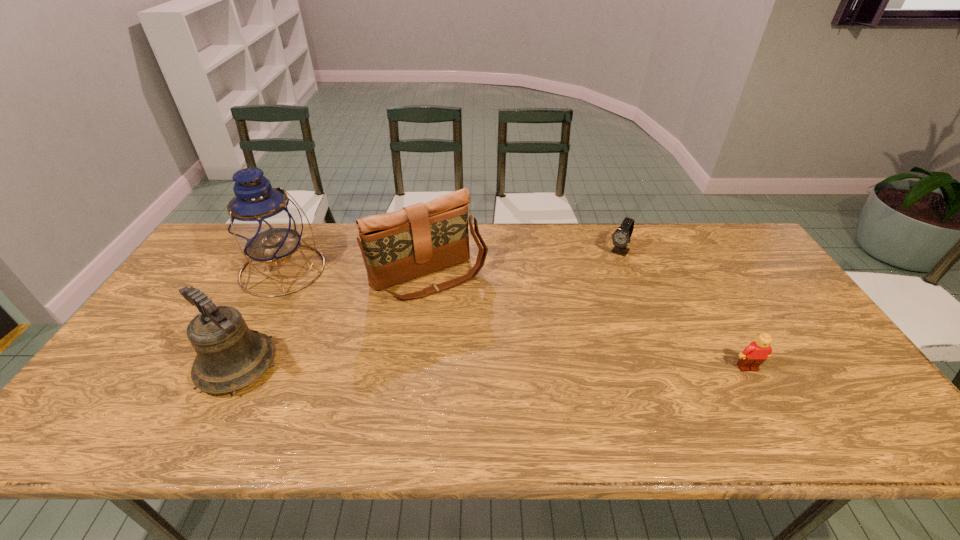
The height and width of the screenshot is (540, 960). Identify the location of bell. (230, 356).

Find the location of a particular element. the rightmost object is located at coordinates (757, 352).

Locate an element on the screen. the tallest object is located at coordinates (263, 222).

Identify the location of the fourth object from left to right. (621, 237).

Locate an element on the screen. Image resolution: width=960 pixels, height=540 pixels. shoulder bag is located at coordinates (420, 239).

Where is `vacant area situated 0.160m on the left of the bell`? vacant area situated 0.160m on the left of the bell is located at coordinates (132, 366).

Find the location of a particular element. This screenshot has height=540, width=960. vacant area located on the face of the rightmost object is located at coordinates (762, 394).

Locate an element on the screen. The image size is (960, 540). free region located 0.180m on the front-facing side of the tallest object is located at coordinates (347, 313).

This screenshot has width=960, height=540. In order to click on vacant space located 0.370m on the front-facing side of the tallest object in this screenshot , I will do `click(394, 346)`.

Identify the location of free space located on the front-facing side of the tallest object. (380, 337).